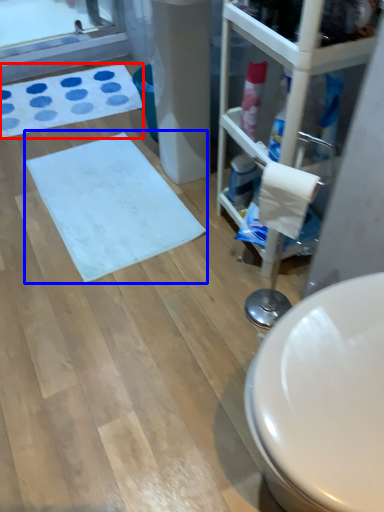
Question: Which point is closer to the camera, bath mat (highlighted by a red box) or bath mat (highlighted by a blue box)?

Choices:
 (A) bath mat
 (B) bath mat

Answer: (B)